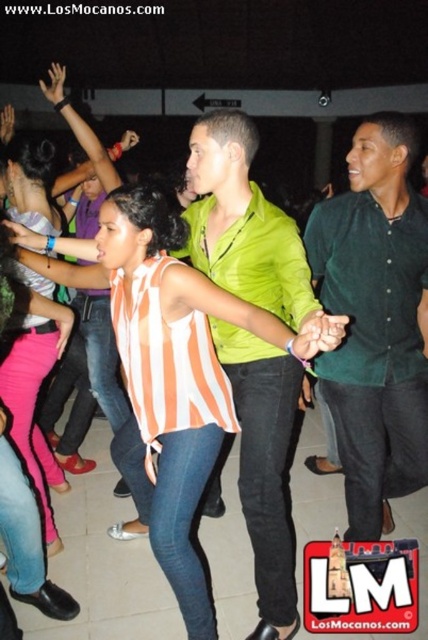
Question: Considering the relative positions of orange striped shirt at center and striped fabric shirt at center in the image provided, where is orange striped shirt at center located with respect to striped fabric shirt at center?

Choices:
 (A) left
 (B) right

Answer: (B)

Question: Which of the following is the farthest from the observer?

Choices:
 (A) striped fabric shirt at center
 (B) dark green button-up shirt at center
 (C) orange striped shirt at center

Answer: (A)

Question: Can you confirm if orange striped shirt at center is wider than dark green button-up shirt at center?

Choices:
 (A) no
 (B) yes

Answer: (B)

Question: Is green matte shirt at center to the right of striped fabric shirt at center from the viewer's perspective?

Choices:
 (A) yes
 (B) no

Answer: (A)

Question: Which object is positioned closest to the green matte shirt at center?

Choices:
 (A) striped fabric shirt at center
 (B) orange striped shirt at center

Answer: (B)

Question: Which is nearer to the green matte shirt at center?

Choices:
 (A) striped fabric shirt at center
 (B) dark green button-up shirt at center

Answer: (B)